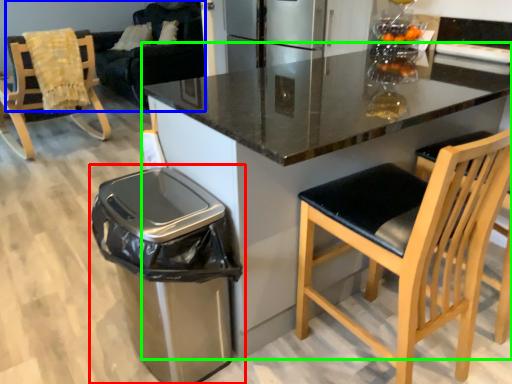
Question: Which is nearer to the waste container (highlighted by a red box)? couch (highlighted by a blue box) or countertop (highlighted by a green box).

Choices:
 (A) couch
 (B) countertop

Answer: (B)